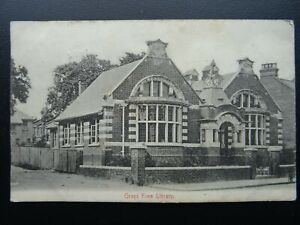
In order to click on entry in this screenshot , I will do `click(229, 146)`.